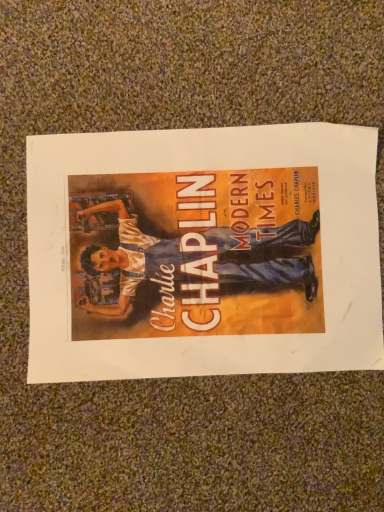
At what (x,y) coordinates should I click in order to perform the action: click on vacant area on top of matte orange poster at center (from a real-world perspective). Please return your answer as a coordinate pair (x, y). Image resolution: width=384 pixels, height=512 pixels. Looking at the image, I should click on (200, 248).